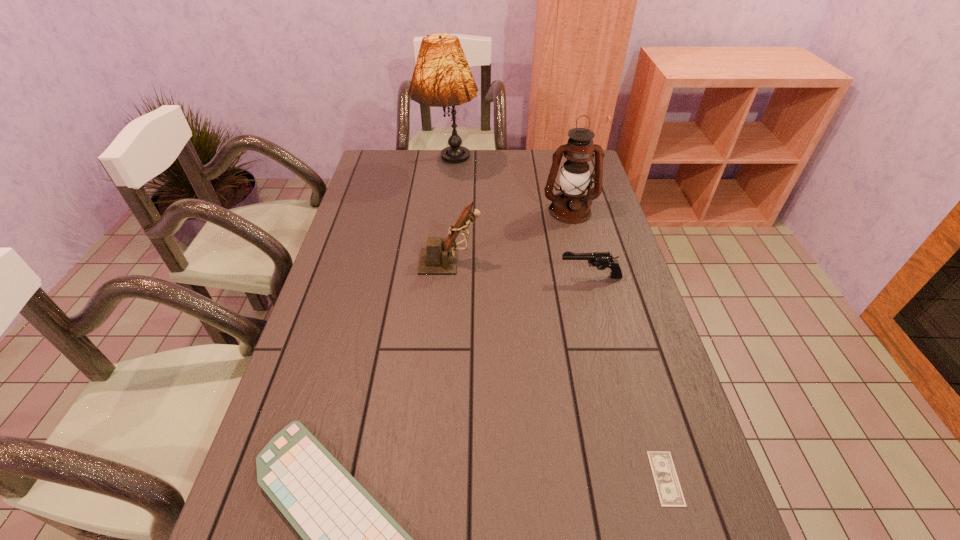
Locate an element on the screen. The height and width of the screenshot is (540, 960). free space at the right edge of the desktop is located at coordinates (653, 329).

At what (x,y) coordinates should I click in order to perform the action: click on vacant space that's between the figurine and the money. Please return your answer as a coordinate pair (x, y). Looking at the image, I should click on [558, 370].

The height and width of the screenshot is (540, 960). Find the location of `vacant space that is in between the second farthest object and the money`. vacant space that is in between the second farthest object and the money is located at coordinates (618, 345).

The width and height of the screenshot is (960, 540). I want to click on blank region between the lantern and the figurine, so click(510, 237).

The height and width of the screenshot is (540, 960). Identify the location of free space between the fifth shortest object and the lampshade. (509, 189).

Locate an element on the screen. The height and width of the screenshot is (540, 960). free space between the shortest object and the lampshade is located at coordinates (557, 322).

Locate an element on the screen. The width and height of the screenshot is (960, 540). vacant area between the shortest object and the tallest object is located at coordinates (557, 322).

Where is `the fourth closest object relative to the money`? This screenshot has width=960, height=540. the fourth closest object relative to the money is located at coordinates (571, 206).

In order to click on object that is the closest to the computer keyboard in this screenshot , I will do `click(670, 494)`.

Identify the location of free region that satisfies the following two spatial constraints: 1. on the side of the fifth nearest object, there is a wick adjustment knob; 2. on the right side of the money. (636, 478).